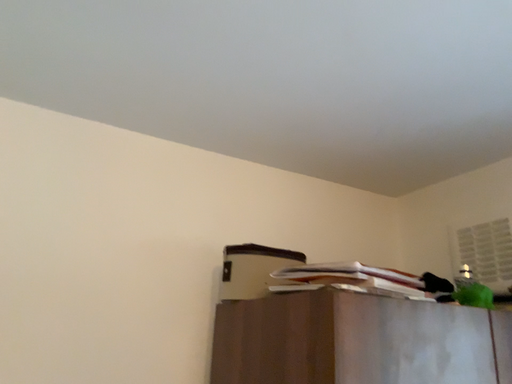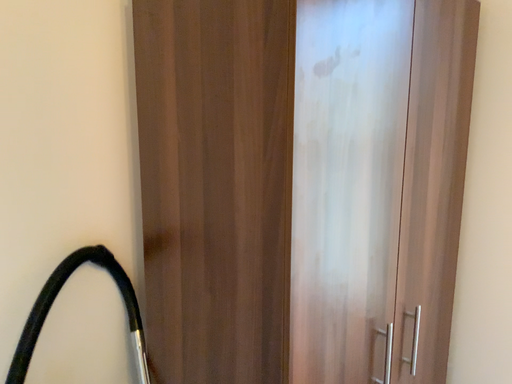
Question: Which way did the camera rotate in the video?

Choices:
 (A) rotated left
 (B) rotated right

Answer: (B)